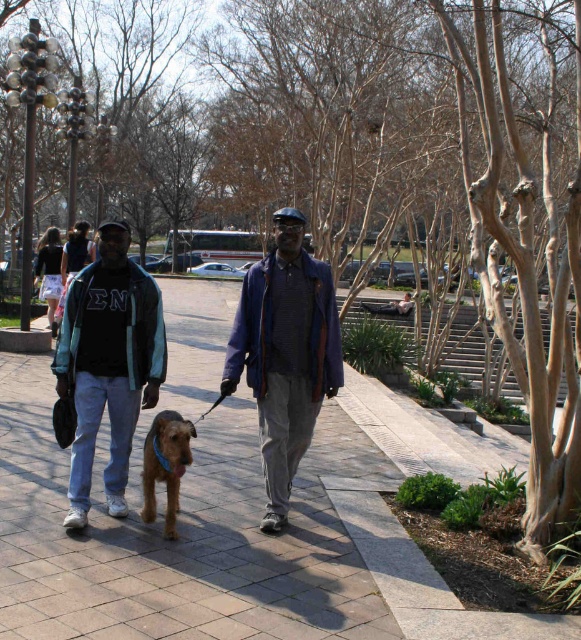
Is the position of dark blue woolen jacket at center less distant than that of brown furry dog at center?

No, dark blue woolen jacket at center is behind brown furry dog at center.

Is point (248, 273) closer to camera compared to point (177, 435)?

No.

Where is `dark blue woolen jacket at center`? This screenshot has height=640, width=581. dark blue woolen jacket at center is located at coordinates (285, 355).

Does matte black jacket at left lie behind brown furry dog at center?

Yes, matte black jacket at left is behind brown furry dog at center.

Which of these two, matte black jacket at left or brown furry dog at center, stands shorter?

brown furry dog at center

Which is in front, point (95, 371) or point (166, 531)?

Point (166, 531) is more forward.

Where is `matte black jacket at left`? matte black jacket at left is located at coordinates [109, 364].

Does brown furry dog at center have a lesser width compared to black cotton jacket at center?

No.

Does brown furry dog at center have a larger size compared to black cotton jacket at center?

Yes.

Locate an element on the screen. The height and width of the screenshot is (640, 581). brown furry dog at center is located at coordinates (166, 465).